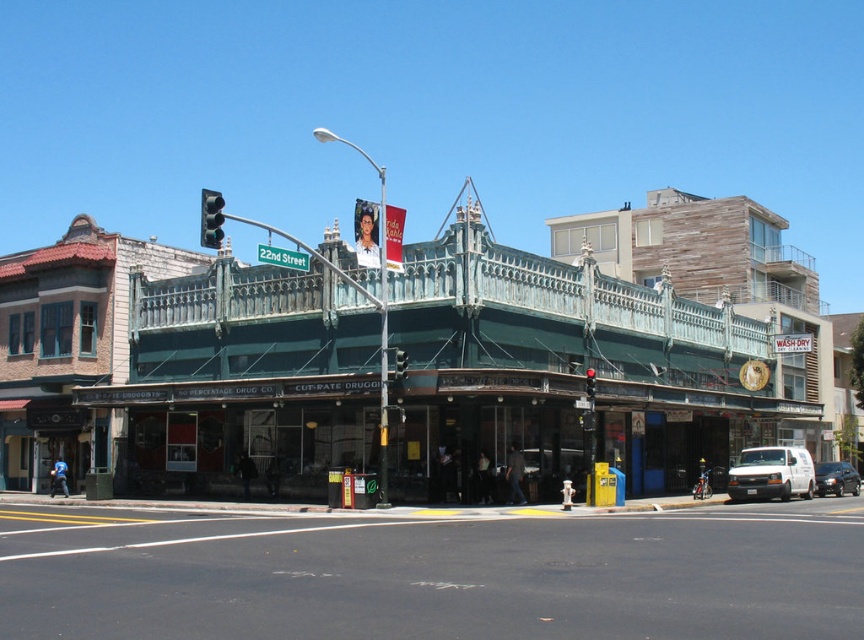
You are a delivery person trying to park your bike. You see the green metal awning at center and the black asphalt at lower center. Which surface should you park your bike on?

You should park your bike on the black asphalt at lower center because it is behind the green metal awning at center, making it a more suitable and accessible surface for parking.

You are standing at the street corner and want to find the entrance to the building with the teal decorative metal railing. Which object at point (599, 356) can help you locate the entrance?

The green metal awning at center located at point (599, 356) is directly above the entrance, so it can help you locate the entrance.

You are a delivery person standing at the camera position. You need to park your delivery van which is 20 feet long. Can you park your van on the black asphalt at lower center without it extending beyond the asphalt? Please explain your reasoning.

The black asphalt at lower center is 27.50 feet away from the camera. Since the van is 20 feet long, which is shorter than the asphalt length, the van can be parked there without extending beyond the asphalt.